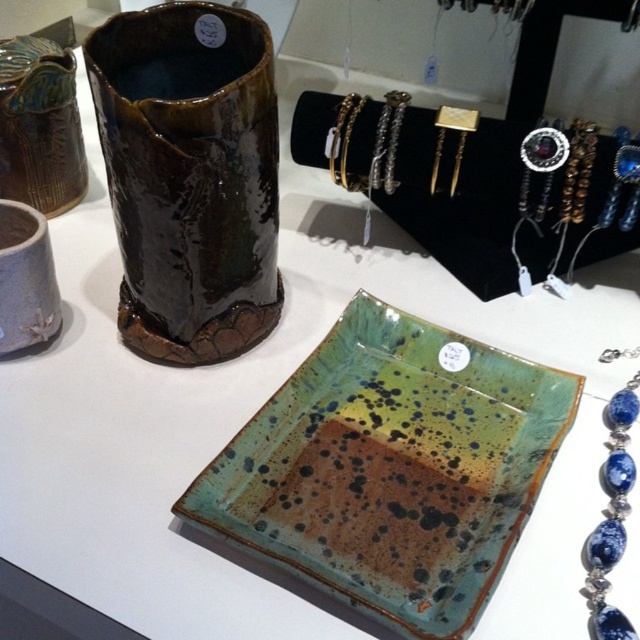
You are at a craft fair and want to locate two points marked in the image. The first point is at coordinates point [156,72] and the second is at point [352,102]. Which point is closer to you?

Point [156,72] is in front of point [352,102], so it is closer to you.

You are at a craft fair and want to place a glossy ceramic vase at upper center and a matte brown vase at left on a shelf. Which vase should you place first to ensure they both fit side by side?

The glossy ceramic vase at upper center might be wider than the matte brown vase at left, so you should place the matte brown vase at left first to accommodate the wider vase next to it.

You are a customer at the craft fair and want to place the gold metallic bracelet at upper center next to the matte brown vase at left. Given their sizes, will the bracelet fit comfortably next to the vase without overcrowding the display?

The matte brown vase at left is wider than the gold metallic bracelet at upper center, so placing the bracelet next to the vase should be possible without overcrowding the display since the vase takes up more space in width.